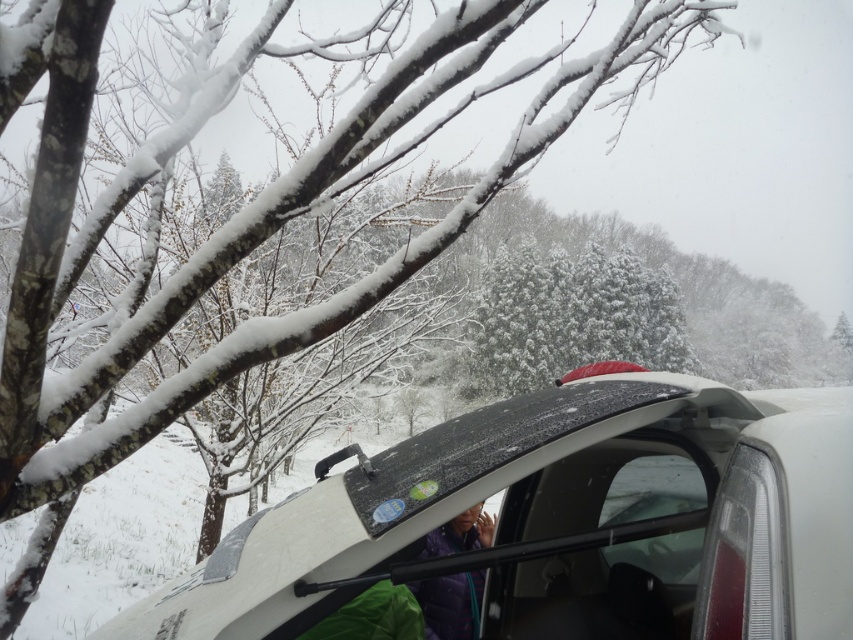
Question: Among these objects, which one is farthest from the camera?

Choices:
 (A) purple fabric at lower center
 (B) white glossy car at lower right

Answer: (A)

Question: Is the position of white glossy car at lower right less distant than that of purple fabric at lower center?

Choices:
 (A) yes
 (B) no

Answer: (A)

Question: Which point is closer to the camera?

Choices:
 (A) purple fabric at lower center
 (B) snow-covered evergreen at center
 (C) white glossy car at lower right

Answer: (C)

Question: Which point is closer to the camera taking this photo?

Choices:
 (A) (247, 592)
 (B) (448, 614)

Answer: (A)

Question: Does white glossy car at lower right have a smaller size compared to purple fabric at lower center?

Choices:
 (A) no
 (B) yes

Answer: (A)

Question: Is white glossy car at lower right positioned before snow-covered evergreen at center?

Choices:
 (A) no
 (B) yes

Answer: (B)